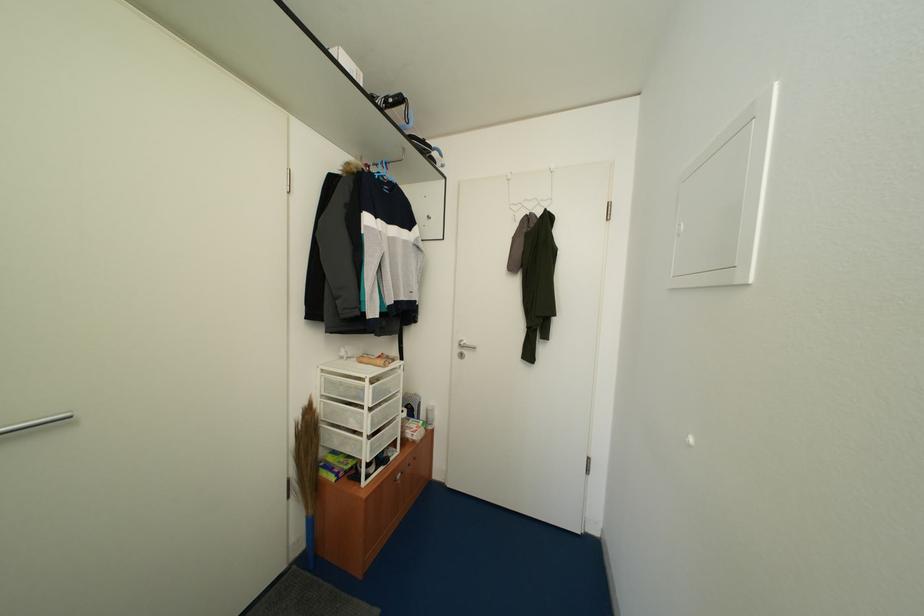
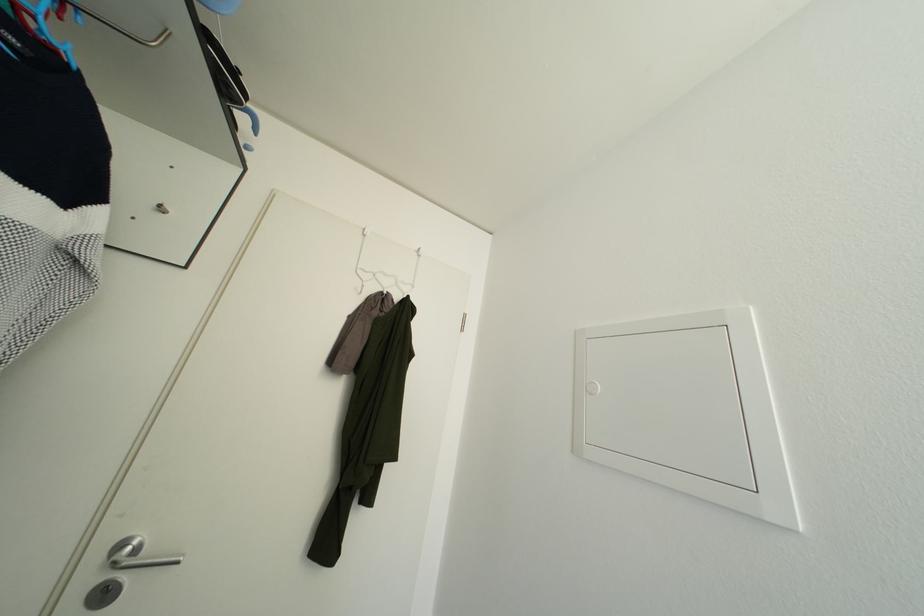
The point at (518, 211) is marked in the first image. Where is the corresponding point in the second image?

(366, 277)